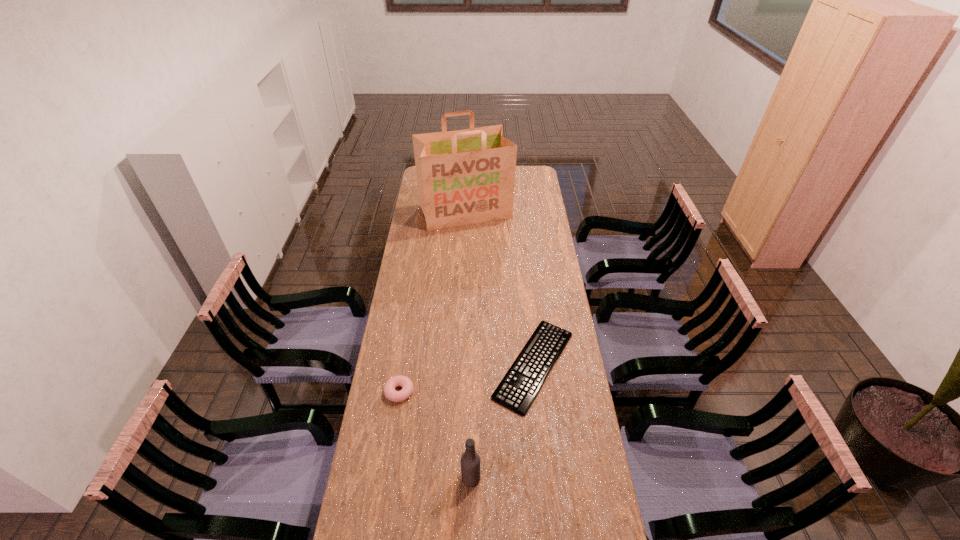
At what (x,y) coordinates should I click in order to perform the action: click on grocery bag located at the left edge. Please return your answer as a coordinate pair (x, y). Image resolution: width=960 pixels, height=540 pixels. Looking at the image, I should click on (464, 177).

The width and height of the screenshot is (960, 540). I want to click on doughnut positioned at the left edge, so click(x=407, y=386).

What are the coordinates of `object at the right edge` in the screenshot? It's located at (518, 389).

Identify the location of vacant region at the left edge of the desktop. (420, 218).

Where is `free region at the right edge`? free region at the right edge is located at coordinates (564, 302).

Where is `free space between the second shortest object and the beer bottle`? Image resolution: width=960 pixels, height=540 pixels. free space between the second shortest object and the beer bottle is located at coordinates (435, 435).

Where is `empty space between the grocery bag and the doughnut`? The height and width of the screenshot is (540, 960). empty space between the grocery bag and the doughnut is located at coordinates (432, 302).

Identify the location of blank region between the shortest object and the second tallest object. This screenshot has width=960, height=540. (502, 422).

The width and height of the screenshot is (960, 540). Find the location of `free space between the tallest object and the shortest object`. free space between the tallest object and the shortest object is located at coordinates (500, 288).

Identify the location of unoccupied position between the shortest object and the third shortest object. The image size is (960, 540). (502, 422).